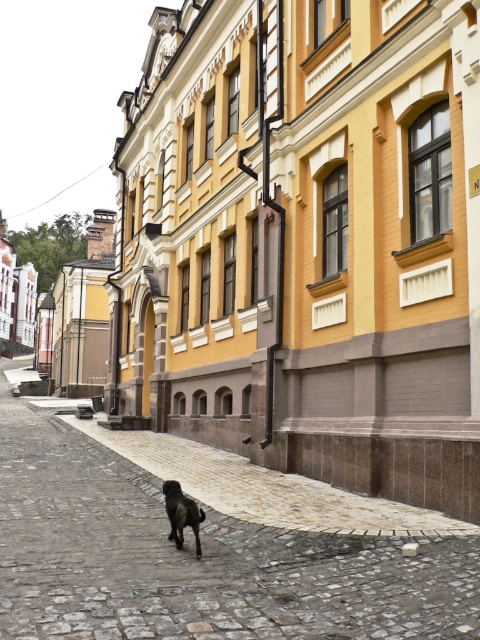
Is gray cobblestone pavement at center taller than shiny black dog at center?

Correct, gray cobblestone pavement at center is much taller as shiny black dog at center.

In the scene shown: Is gray cobblestone pavement at center below shiny black dog at center?

Correct, gray cobblestone pavement at center is located below shiny black dog at center.

Locate an element on the screen. The height and width of the screenshot is (640, 480). gray cobblestone pavement at center is located at coordinates (194, 557).

Find the location of a particular element. gray cobblestone pavement at center is located at coordinates (194, 557).